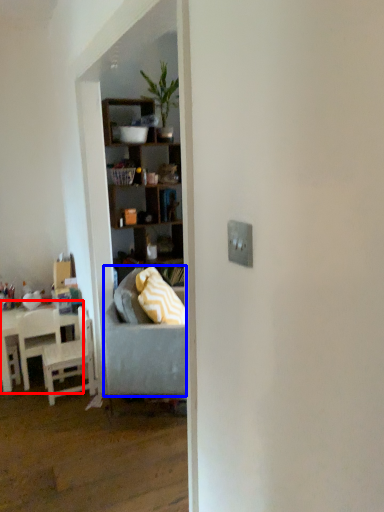
Question: Which object is closer to the camera taking this photo, table (highlighted by a red box) or studio couch (highlighted by a blue box)?

Choices:
 (A) table
 (B) studio couch

Answer: (B)